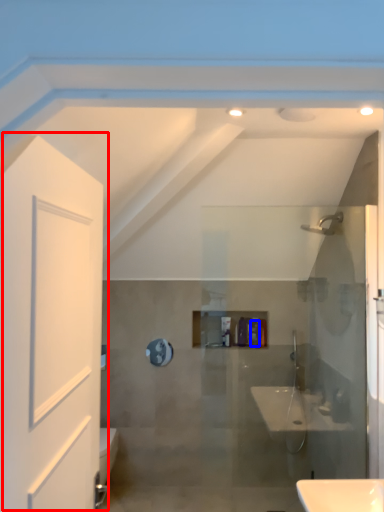
Question: Among these objects, which one is nearest to the camera, door (highlighted by a red box) or toiletry (highlighted by a blue box)?

Choices:
 (A) door
 (B) toiletry

Answer: (A)